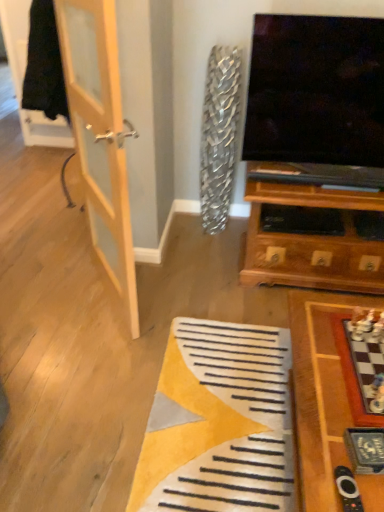
Locate an element on the screen. vacant point to the left of wooden chessboard at lower right is located at coordinates (190, 423).